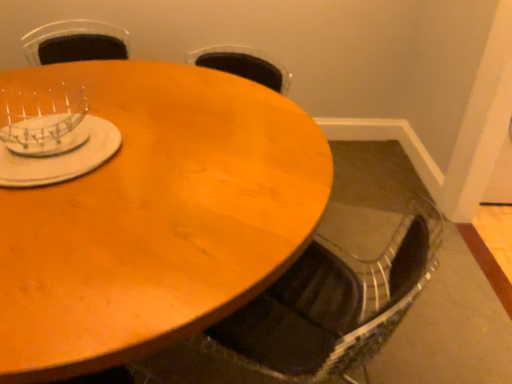
Question: From a real-world perspective, is metallic silver swivel chair at lower center on clear plastic dish rack at upper left, which is the first tableware in top-to-bottom order?

Choices:
 (A) no
 (B) yes

Answer: (A)

Question: From a real-world perspective, does metallic silver swivel chair at lower center sit lower than clear plastic dish rack at upper left, which is the first tableware in top-to-bottom order?

Choices:
 (A) yes
 (B) no

Answer: (A)

Question: Is metallic silver swivel chair at lower center shorter than clear plastic dish rack at upper left, placed as the 2th tableware when sorted from bottom to top?

Choices:
 (A) no
 (B) yes

Answer: (A)

Question: Can you confirm if metallic silver swivel chair at lower center is positioned to the left of clear plastic dish rack at upper left, placed as the 2th tableware when sorted from bottom to top?

Choices:
 (A) no
 (B) yes

Answer: (A)

Question: Is metallic silver swivel chair at lower center closer to camera compared to clear plastic dish rack at upper left, placed as the 2th tableware when sorted from bottom to top?

Choices:
 (A) no
 (B) yes

Answer: (B)

Question: Considering the relative sizes of metallic silver swivel chair at lower center and clear plastic dish rack at upper left, placed as the 2th tableware when sorted from bottom to top, in the image provided, is metallic silver swivel chair at lower center bigger than clear plastic dish rack at upper left, placed as the 2th tableware when sorted from bottom to top,?

Choices:
 (A) yes
 (B) no

Answer: (A)

Question: Does metallic silver swivel chair at lower center lie in front of wooden table at center?

Choices:
 (A) no
 (B) yes

Answer: (A)

Question: Can you confirm if metallic silver swivel chair at lower center is shorter than wooden table at center?

Choices:
 (A) no
 (B) yes

Answer: (A)

Question: From the image's perspective, would you say metallic silver swivel chair at lower center is shown under wooden table at center?

Choices:
 (A) yes
 (B) no

Answer: (A)

Question: Is metallic silver swivel chair at lower center smaller than wooden table at center?

Choices:
 (A) yes
 (B) no

Answer: (A)

Question: Can you confirm if metallic silver swivel chair at lower center is taller than wooden table at center?

Choices:
 (A) yes
 (B) no

Answer: (A)

Question: Considering the relative positions of metallic silver swivel chair at lower center and wooden table at center in the image provided, is metallic silver swivel chair at lower center to the right of wooden table at center from the viewer's perspective?

Choices:
 (A) no
 (B) yes

Answer: (B)

Question: From a real-world perspective, is wooden table at center located beneath metallic silver swivel chair at lower center?

Choices:
 (A) yes
 (B) no

Answer: (A)